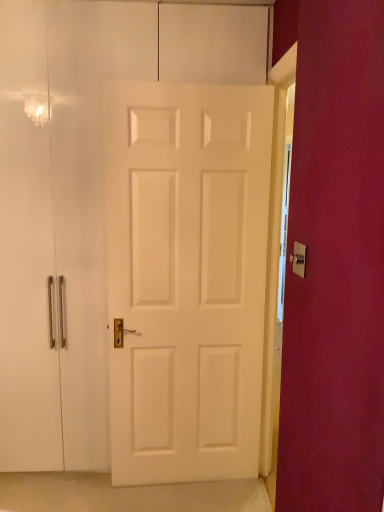
Find the location of a particular element. free spot above white matte door at center (from a real-world perspective) is located at coordinates (146, 1).